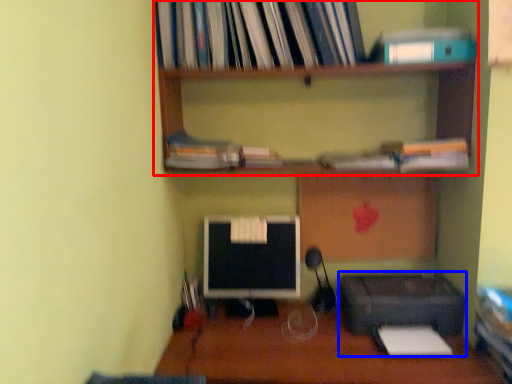
Question: Among these objects, which one is nearest to the camera, shelf (highlighted by a red box) or printer (highlighted by a blue box)?

Choices:
 (A) shelf
 (B) printer

Answer: (B)